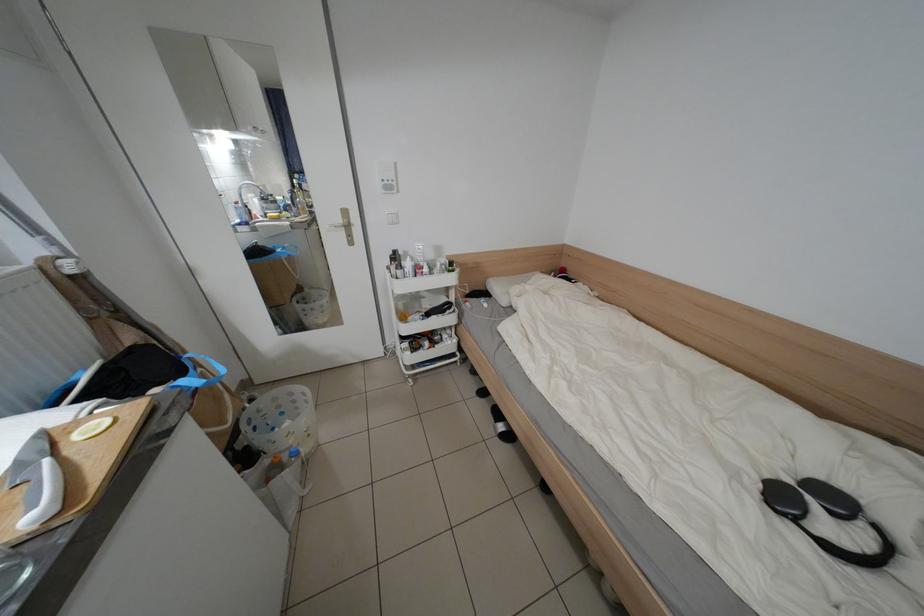
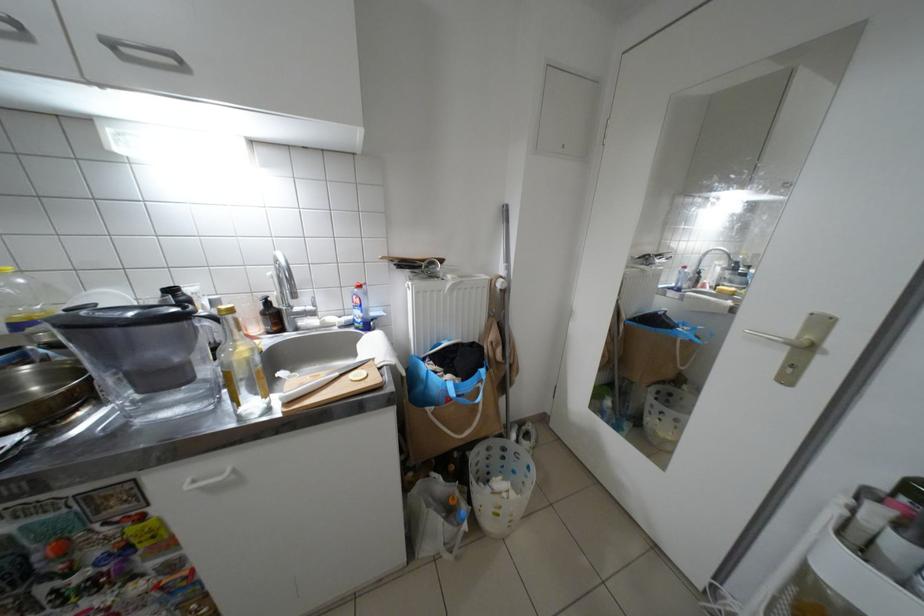
Find the pixel in the second image that matches (86,302) in the first image.

(502, 304)